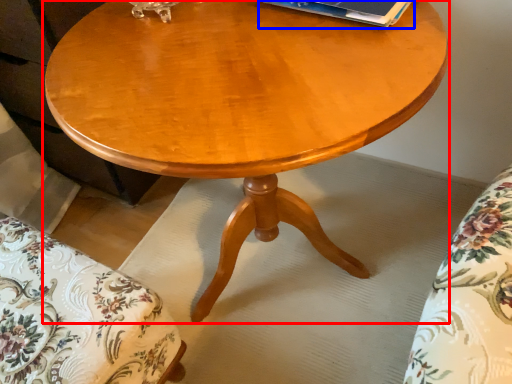
Question: Which of the following is the closest to the observer, coffee table (highlighted by a red box) or paperback book (highlighted by a blue box)?

Choices:
 (A) coffee table
 (B) paperback book

Answer: (A)